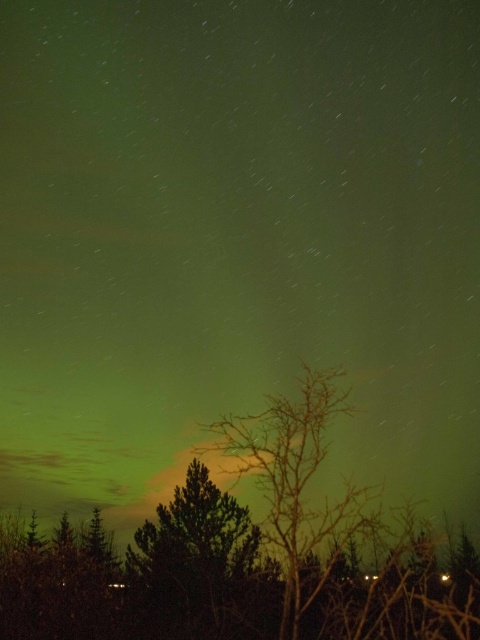
Question: In this image, where is green leafless tree at center located relative to green leafy tree at center?

Choices:
 (A) below
 (B) above

Answer: (B)

Question: Does green leafless tree at center appear under green leafy tree at center?

Choices:
 (A) no
 (B) yes

Answer: (A)

Question: Which of the following is the closest to the observer?

Choices:
 (A) green leafy tree at center
 (B) green leafless tree at center

Answer: (B)

Question: Can you confirm if green leafless tree at center is thinner than green leafy tree at center?

Choices:
 (A) yes
 (B) no

Answer: (B)

Question: Which of the following is the farthest from the observer?

Choices:
 (A) (342, 502)
 (B) (218, 509)

Answer: (B)